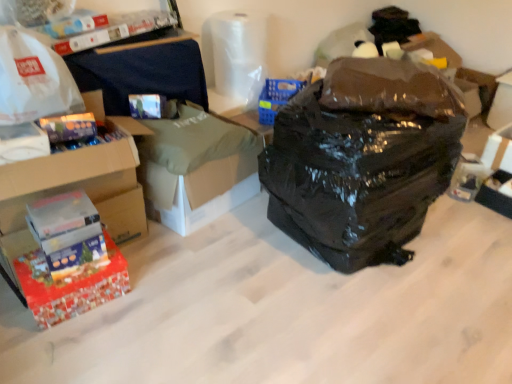
Where is `vacant area that lies between black plastic bag at center and red glossy box at lower left, the 1th box from the bottom`? Image resolution: width=512 pixels, height=384 pixels. vacant area that lies between black plastic bag at center and red glossy box at lower left, the 1th box from the bottom is located at coordinates (215, 274).